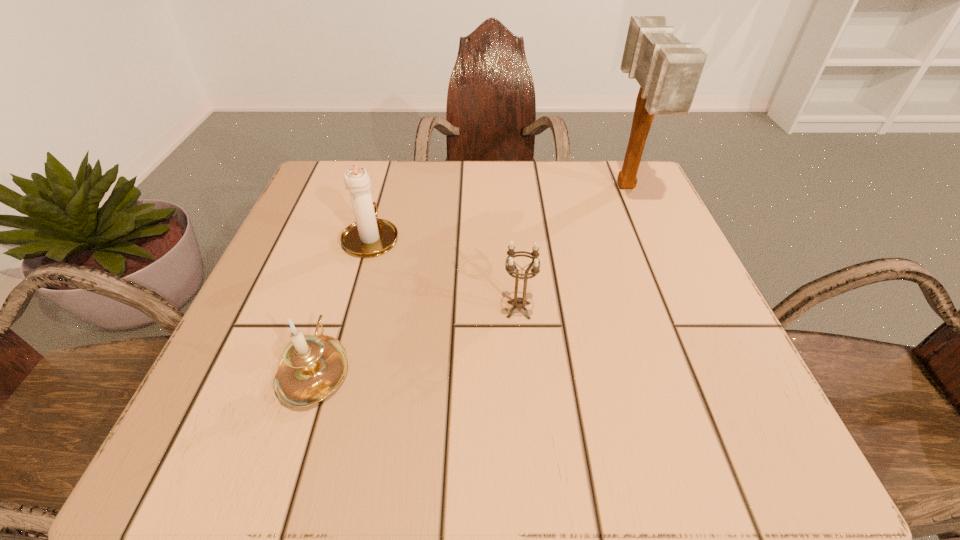
Identify the location of the tallest object. coord(668,71).

I want to click on the rightmost object, so click(x=668, y=71).

The height and width of the screenshot is (540, 960). Find the location of `the second tallest object`. the second tallest object is located at coordinates (369, 236).

Identify the location of the farthest candle holder. (369, 236).

Locate an element on the screen. Image resolution: width=960 pixels, height=540 pixels. the rightmost candle holder is located at coordinates 518,302.

I want to click on the second nearest object, so tap(518, 302).

Image resolution: width=960 pixels, height=540 pixels. Find the location of `the nearest object`. the nearest object is located at coordinates (312, 367).

At what (x,y) coordinates should I click in order to perform the action: click on free space located 0.200m on the left of the mallet. Please return your answer as a coordinate pair (x, y). The image size is (960, 540). Looking at the image, I should click on (519, 187).

The width and height of the screenshot is (960, 540). Identify the location of vacant area located on the handle side of the tallest candle holder. (384, 192).

Identify the location of vacant space situated 0.180m on the handle side of the tallest candle holder. The width and height of the screenshot is (960, 540). (391, 171).